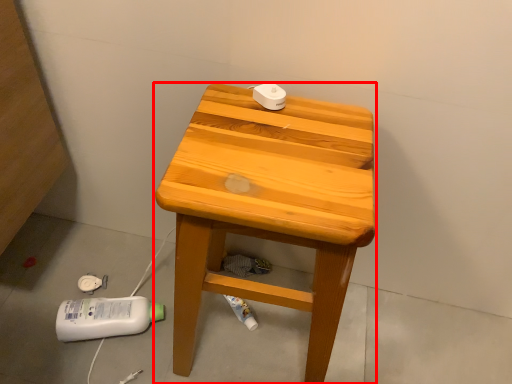
Question: From the image's perspective, where is stool (annotated by the red box) located relative to concrete?

Choices:
 (A) above
 (B) below

Answer: (A)